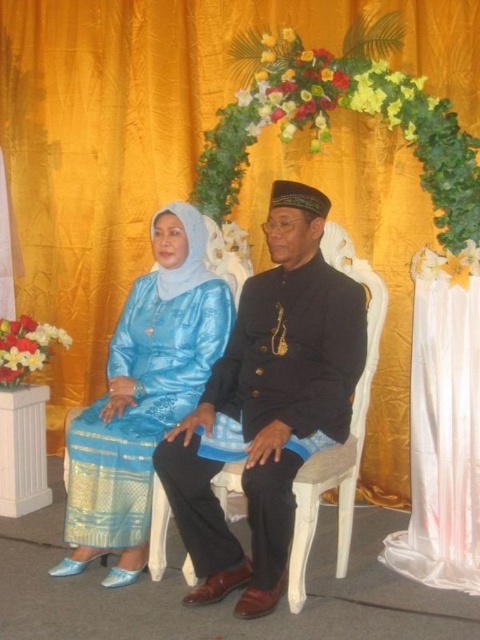
Question: Is black satin suit at center closer to camera compared to white satin curtain at right?

Choices:
 (A) no
 (B) yes

Answer: (B)

Question: Which object is farther from the camera taking this photo?

Choices:
 (A) satin blue dress at center
 (B) white satin curtain at right
 (C) black satin suit at center

Answer: (A)

Question: Does black satin suit at center have a greater width compared to white satin curtain at right?

Choices:
 (A) no
 (B) yes

Answer: (B)

Question: Which is farther from the satin blue dress at center?

Choices:
 (A) black satin suit at center
 (B) white satin curtain at right

Answer: (B)

Question: Is satin blue dress at center bigger than white satin curtain at right?

Choices:
 (A) no
 (B) yes

Answer: (B)

Question: Which point is closer to the camera taking this photo?

Choices:
 (A) (265, 388)
 (B) (216, 310)
 (C) (478, 445)

Answer: (A)